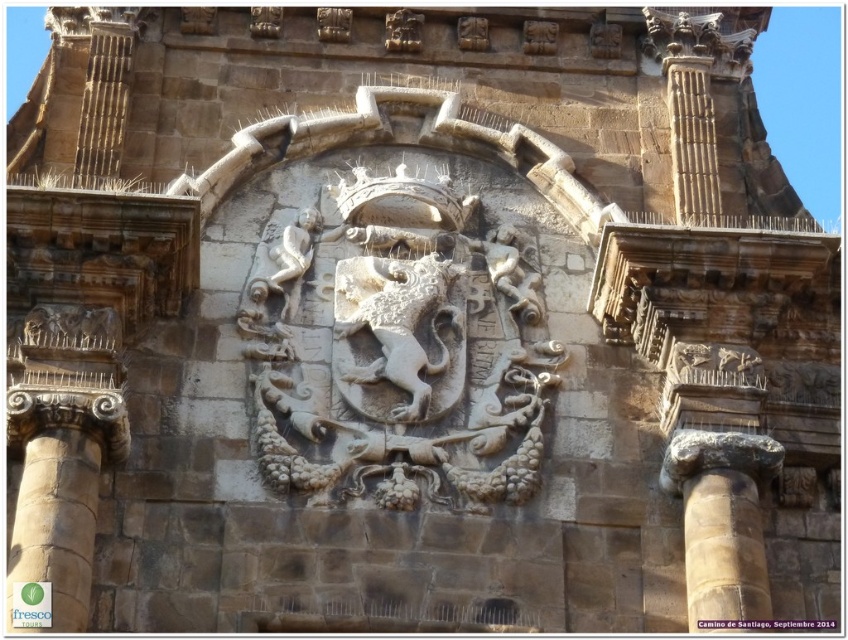
Is white stone crest at center smaller than brown stone column at right?

No, white stone crest at center is not smaller than brown stone column at right.

Which is behind, point (523, 240) or point (707, 572)?

Point (523, 240)

Identify the location of white stone crest at center. (397, 346).